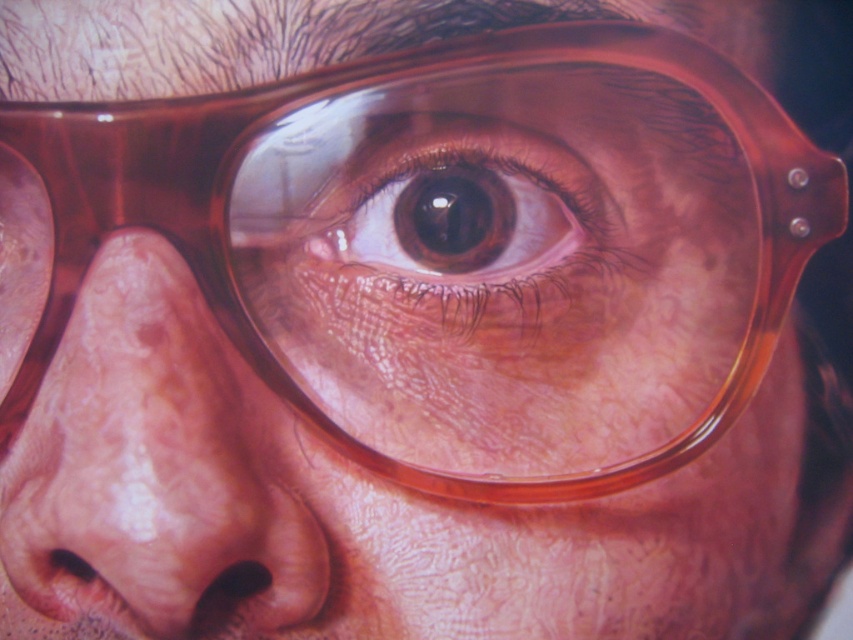
Question: Which of the following is the farthest from the observer?

Choices:
 (A) (601, 328)
 (B) (102, 397)

Answer: (A)

Question: Is matte flesh-toned nose at center below brown glossy eye at center?

Choices:
 (A) yes
 (B) no

Answer: (A)

Question: In this image, where is matte flesh-toned nose at center located relative to brown glossy eye at center?

Choices:
 (A) right
 (B) left

Answer: (B)

Question: Is matte flesh-toned nose at center thinner than brown glossy eye at center?

Choices:
 (A) yes
 (B) no

Answer: (A)